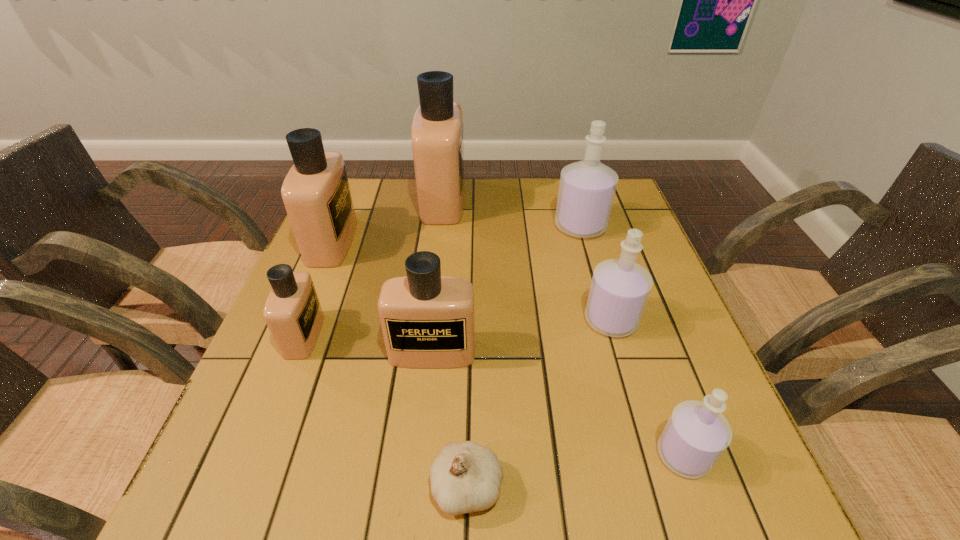
Where is `blank region between the biggest purple perfume and the second biggest beige perfume`? blank region between the biggest purple perfume and the second biggest beige perfume is located at coordinates (456, 234).

The height and width of the screenshot is (540, 960). I want to click on empty space that is in between the shortest object and the smallest beige perfume, so click(x=386, y=411).

Locate an element on the screen. The height and width of the screenshot is (540, 960). vacant space in between the garlic and the smallest beige perfume is located at coordinates (386, 411).

At what (x,y) coordinates should I click in order to perform the action: click on vacant space that's between the garlic and the smallest purple perfume. Please return your answer as a coordinate pair (x, y). The width and height of the screenshot is (960, 540). Looking at the image, I should click on (575, 471).

Identify which object is the nearest to the second nearest purple perfume. Please provide its 2D coordinates. Your answer should be formatted as a tuple, i.e. [(x, y)], where the tuple contains the x and y coordinates of a point satisfying the conditions above.

[(696, 435)]

Locate an element on the screen. The image size is (960, 540). object that ranks as the sixth closest to the tallest object is located at coordinates (466, 477).

Locate which perfume is the fourth closest to the smallest beige perfume. Please provide its 2D coordinates. Your answer should be formatted as a tuple, i.e. [(x, y)], where the tuple contains the x and y coordinates of a point satisfying the conditions above.

[(619, 290)]

At what (x,y) coordinates should I click in order to perform the action: click on the closest perfume relative to the third smallest beige perfume. Please return your answer as a coordinate pair (x, y). The width and height of the screenshot is (960, 540). Looking at the image, I should click on (292, 312).

Point out which beige perfume is positioned as the third nearest to the second biggest beige perfume. Please provide its 2D coordinates. Your answer should be formatted as a tuple, i.e. [(x, y)], where the tuple contains the x and y coordinates of a point satisfying the conditions above.

[(428, 321)]

Select which beige perfume is the fourth closest to the nearest perfume. Please provide its 2D coordinates. Your answer should be formatted as a tuple, i.e. [(x, y)], where the tuple contains the x and y coordinates of a point satisfying the conditions above.

[(316, 194)]